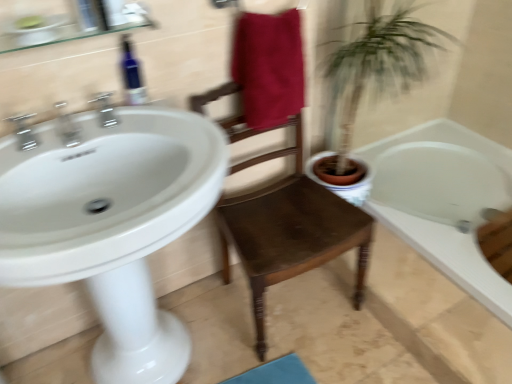
Identify the location of vacant space to the right of silver metallic faucet at upper left, the first tap in the right-to-left sequence. (165, 130).